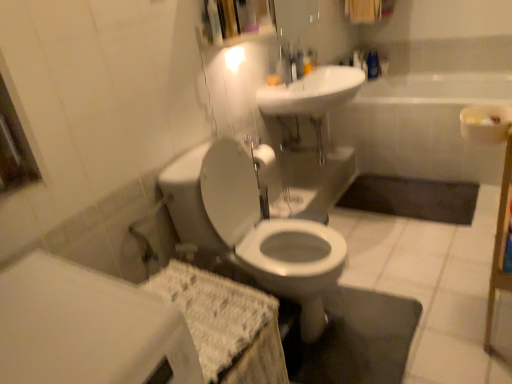
The width and height of the screenshot is (512, 384). What do you see at coordinates (252, 225) in the screenshot?
I see `white glossy toilet at center` at bounding box center [252, 225].

Measure the distance between white glossy sink at upper center and camera.

The distance of white glossy sink at upper center from camera is 7.06 feet.

This screenshot has height=384, width=512. What do you see at coordinates (312, 92) in the screenshot? I see `white glossy sink at upper center` at bounding box center [312, 92].

You are a GUI agent. You are given a task and a screenshot of the screen. Output one action in this format:
    pyautogui.click(x=<x>, y=<y>)
    Task: Click on the dark gray rubber bath mat at lower center
    
    Given the screenshot: What is the action you would take?
    pyautogui.click(x=412, y=198)

This screenshot has height=384, width=512. Describe the element at coordinates (286, 64) in the screenshot. I see `white glossy faucet at upper center` at that location.

Identify the location of white glossy toilet at center. (252, 225).

Measure the distance from white glossy faucet at upper center to dark gray rubber bath mat at lower center.

white glossy faucet at upper center and dark gray rubber bath mat at lower center are 3.46 feet apart from each other.

How different are the orientations of white glossy faucet at upper center and dark gray rubber bath mat at lower center in degrees?

84.7 degrees separate the facing orientations of white glossy faucet at upper center and dark gray rubber bath mat at lower center.

Based on their sizes in the image, would you say white glossy faucet at upper center is bigger or smaller than dark gray rubber bath mat at lower center?

Clearly, white glossy faucet at upper center is smaller in size than dark gray rubber bath mat at lower center.

Is white glossy faucet at upper center aimed at dark gray rubber bath mat at lower center?

No, white glossy faucet at upper center is not oriented towards dark gray rubber bath mat at lower center.

From the image's perspective, which is above, dark gray rubber bath mat at lower center or white ceramic bathtub at center?

→ white ceramic bathtub at center appears higher in the image.

Which is closer, (364, 204) or (483, 86)?

Point (364, 204) is closer to the camera than point (483, 86).

Between dark gray rubber bath mat at lower center and white ceramic bathtub at center, which one has more height?

white ceramic bathtub at center is taller.

Considering the sizes of dark gray rubber bath mat at lower center and white ceramic bathtub at center in the image, is dark gray rubber bath mat at lower center wider or thinner than white ceramic bathtub at center?

Clearly, dark gray rubber bath mat at lower center has less width compared to white ceramic bathtub at center.

Between white ceramic bathtub at center and white glossy sink at upper center, which one has more height?

With more height is white ceramic bathtub at center.

How far apart are white ceramic bathtub at center and white glossy sink at upper center?

white ceramic bathtub at center is 58.85 centimeters from white glossy sink at upper center.

Is white ceramic bathtub at center bigger or smaller than white glossy sink at upper center?

Clearly, white ceramic bathtub at center is larger in size than white glossy sink at upper center.

Is white glossy sink at upper center at the back of white ceramic bathtub at center?

That's not correct — white ceramic bathtub at center is not looking away from white glossy sink at upper center.

In the image, is white glossy sink at upper center on the left side or the right side of white ceramic bathtub at center?

Clearly, white glossy sink at upper center is on the left of white ceramic bathtub at center in the image.

Is white glossy sink at upper center turned away from white ceramic bathtub at center?

No, white glossy sink at upper center's orientation is not away from white ceramic bathtub at center.

Choose the correct answer: Is white glossy sink at upper center inside white ceramic bathtub at center or outside it?

white glossy sink at upper center is spatially situated outside white ceramic bathtub at center.

Which of these two, white glossy sink at upper center or white ceramic bathtub at center, is thinner?

white glossy sink at upper center is thinner.

Does point (361, 131) come closer to viewer compared to point (296, 296)?

No, it is not.

The image size is (512, 384). Identify the location of toilet lying on the left of white ceramic bathtub at center. (252, 225).

Based on their sizes in the image, would you say white ceramic bathtub at center is bigger or smaller than white glossy toilet at center?

In the image, white ceramic bathtub at center appears to be larger than white glossy toilet at center.

Can you tell me how much white ceramic bathtub at center and white glossy toilet at center differ in facing direction?

The facing directions of white ceramic bathtub at center and white glossy toilet at center are 89.6 degrees apart.

Is dark gray rubber bath mat at lower center outside of white glossy toilet at center?

That's correct, dark gray rubber bath mat at lower center is outside of white glossy toilet at center.

Does dark gray rubber bath mat at lower center have a smaller size compared to white glossy toilet at center?

Indeed, dark gray rubber bath mat at lower center has a smaller size compared to white glossy toilet at center.

Could you tell me if dark gray rubber bath mat at lower center is facing white glossy toilet at center?

Yes, dark gray rubber bath mat at lower center is oriented towards white glossy toilet at center.

Does point (343, 246) come closer to viewer compared to point (406, 132)?

Yes, point (343, 246) is in front of point (406, 132).

Is white glossy toilet at center aimed at white ceramic bathtub at center?

No, white glossy toilet at center is not turned towards white ceramic bathtub at center.

Between white glossy toilet at center and white ceramic bathtub at center, which one has smaller width?

white glossy toilet at center.

From the image's perspective, which is below, white glossy toilet at center or white ceramic bathtub at center?

white glossy toilet at center, from the image's perspective.

Where is `bath mat lying below the white glossy faucet at upper center (from the image's perspective)`? bath mat lying below the white glossy faucet at upper center (from the image's perspective) is located at coordinates (412, 198).

I want to click on bath that appears behind the dark gray rubber bath mat at lower center, so click(422, 125).

Considering their positions, is white glossy sink at upper center positioned closer to white ceramic bathtub at center than white glossy toilet at center?

The object closer to white ceramic bathtub at center is white glossy sink at upper center.

Which object lies further to the anchor point dark gray rubber bath mat at lower center, white ceramic bathtub at center or white glossy faucet at upper center?

The object further to dark gray rubber bath mat at lower center is white glossy faucet at upper center.

In the scene shown: Based on their spatial positions, is white glossy faucet at upper center or white glossy sink at upper center further from dark gray rubber bath mat at lower center?

The object further to dark gray rubber bath mat at lower center is white glossy faucet at upper center.

Based on the photo, from the image, which object appears to be nearer to white glossy sink at upper center, white ceramic bathtub at center or white glossy toilet at center?

white ceramic bathtub at center is closer to white glossy sink at upper center.

In the scene shown: Estimate the real-world distances between objects in this image. Which object is closer to white glossy sink at upper center, white ceramic bathtub at center or white glossy faucet at upper center?

white glossy faucet at upper center is closer to white glossy sink at upper center.

Based on their spatial positions, is dark gray rubber bath mat at lower center or white glossy sink at upper center closer to white ceramic bathtub at center?

dark gray rubber bath mat at lower center is positioned closer to the anchor white ceramic bathtub at center.

Estimate the real-world distances between objects in this image. Which object is closer to white glossy faucet at upper center, white glossy sink at upper center or white glossy toilet at center?

The object closer to white glossy faucet at upper center is white glossy sink at upper center.

Looking at the image, which one is located closer to white glossy toilet at center, white glossy sink at upper center or white ceramic bathtub at center?

white glossy sink at upper center is closer to white glossy toilet at center.

Find the location of a particular element. The height and width of the screenshot is (384, 512). bath mat between white glossy faucet at upper center and white ceramic bathtub at center in the horizontal direction is located at coordinates (412, 198).

Identify the location of faucet between white glossy toilet at center and white ceramic bathtub at center in the horizontal direction. (286, 64).

Where is `sink situated between white glossy faucet at upper center and dark gray rubber bath mat at lower center from left to right`? sink situated between white glossy faucet at upper center and dark gray rubber bath mat at lower center from left to right is located at coordinates (312, 92).

Locate an element on the screen. The height and width of the screenshot is (384, 512). faucet between white glossy toilet at center and dark gray rubber bath mat at lower center in the front-back direction is located at coordinates (286, 64).